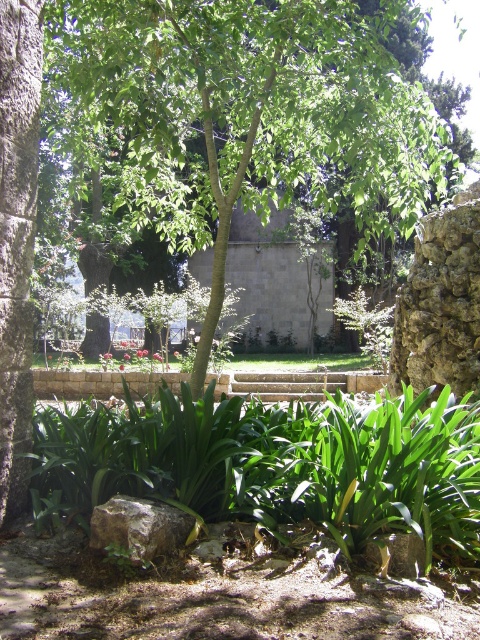
Is green leafy tree at center closer to the viewer compared to rusty metallic rock at center?

No, green leafy tree at center is further to the viewer.

Is point (215, 243) less distant than point (141, 524)?

No, (215, 243) is further to viewer.

You are a GUI agent. You are given a task and a screenshot of the screen. Output one action in this format:
    pyautogui.click(x=<x>, y=<y>)
    Task: Click on the green leafy tree at center
    Image resolution: width=480 pixels, height=640 pixels.
    Given the screenshot: What is the action you would take?
    [x=248, y=116]